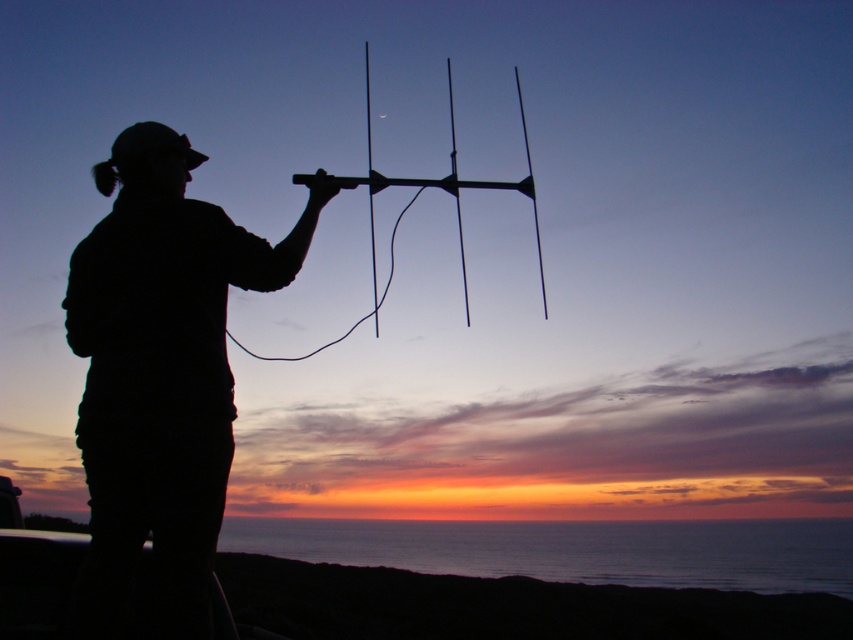
Question: Which point is closer to the camera?

Choices:
 (A) black matte antenna at center
 (B) silhouette fabric at left

Answer: (B)

Question: Can you confirm if silhouette fabric at left is bigger than black matte antenna at center?

Choices:
 (A) yes
 (B) no

Answer: (B)

Question: Is silhouette fabric at left closer to the viewer compared to black matte antenna at center?

Choices:
 (A) yes
 (B) no

Answer: (A)

Question: Which point is farther from the camera taking this photo?

Choices:
 (A) (93, 394)
 (B) (373, 307)

Answer: (B)

Question: Does silhouette fabric at left lie in front of black matte antenna at center?

Choices:
 (A) yes
 (B) no

Answer: (A)